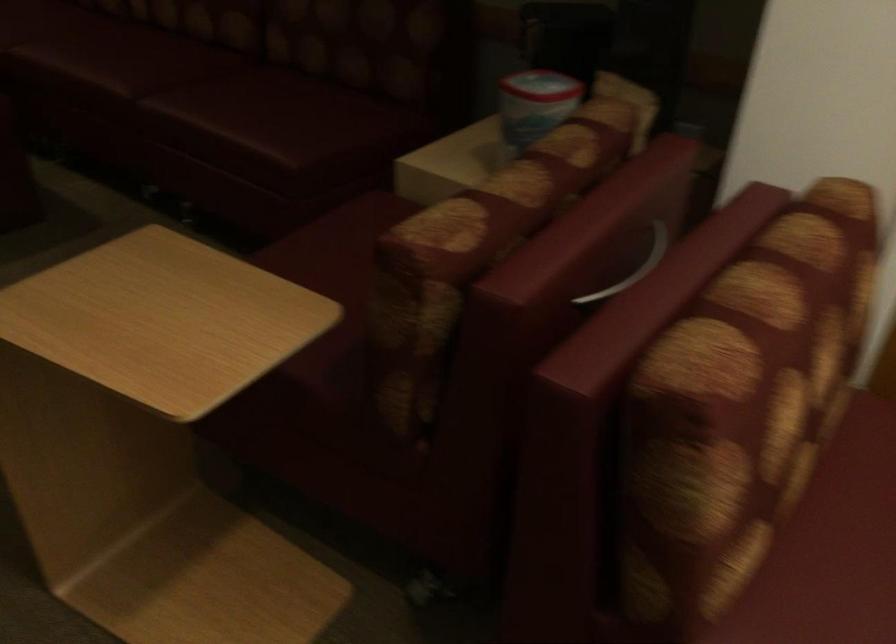
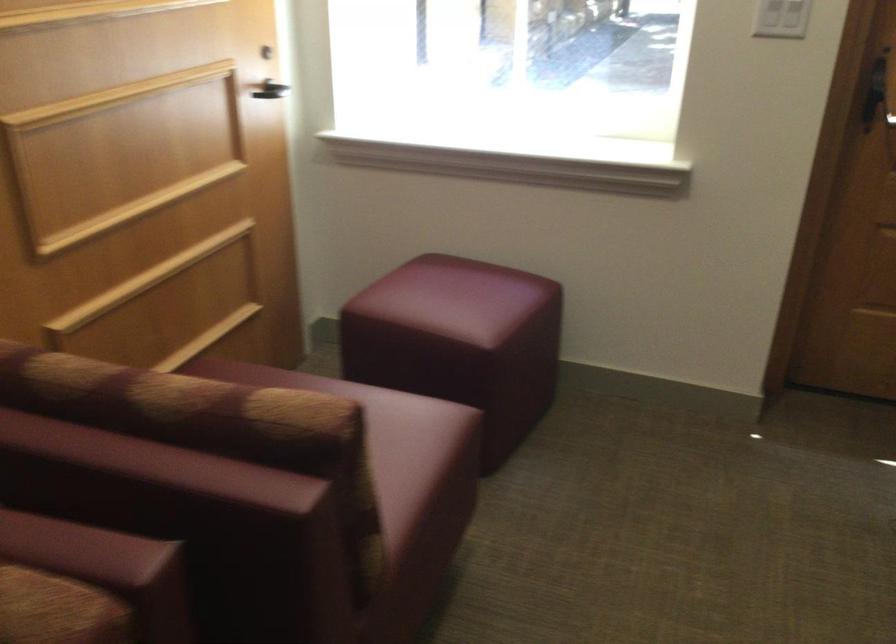
The point at (539, 287) is marked in the first image. Where is the corresponding point in the second image?

(82, 550)